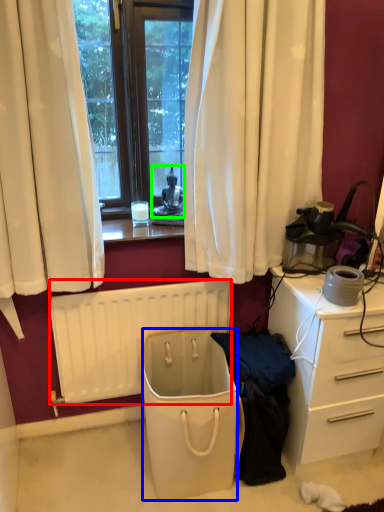
Question: Considering the real-world distances, which object is closest to radiator (highlighted by a red box)? trash bin/can (highlighted by a blue box) or person (highlighted by a green box).

Choices:
 (A) trash bin/can
 (B) person

Answer: (A)